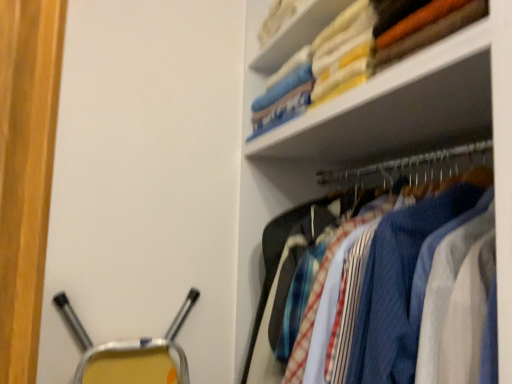
Question: In terms of size, does textured fabric shirts at upper right appear bigger or smaller than soft cotton towels at upper right?

Choices:
 (A) small
 (B) big

Answer: (B)

Question: Visually, is textured fabric shirts at upper right positioned to the left or to the right of soft cotton towels at upper right?

Choices:
 (A) right
 (B) left

Answer: (A)

Question: Based on their relative distances, which object is nearer to the white fabric at upper right?

Choices:
 (A) soft cotton towels at upper right
 (B) textured fabric shirts at upper right

Answer: (A)

Question: Which object is the farthest from the soft cotton towels at upper right?

Choices:
 (A) white fabric at upper right
 (B) textured fabric shirts at upper right

Answer: (B)